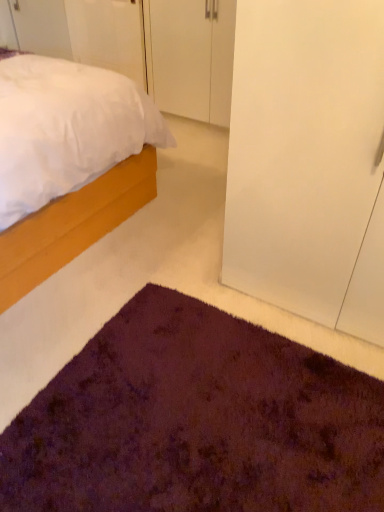
Question: Is transparent glass door at right in front of or behind purple shaggy rug at lower center in the image?

Choices:
 (A) behind
 (B) front

Answer: (A)

Question: Is point (268, 110) closer or farther from the camera than point (82, 393)?

Choices:
 (A) closer
 (B) farther

Answer: (A)

Question: Which of these objects is positioned farthest from the white matte cabinet at upper center, marked as the 2th door in a left-to-right arrangement?

Choices:
 (A) white matte door at upper left, which is the 2th door in right-to-left order
 (B) purple shaggy rug at lower center
 (C) transparent glass door at right
 (D) matte wood bed at left

Answer: (B)

Question: Estimate the real-world distances between objects in this image. Which object is closer to the white matte door at upper left, which is the 2th door in right-to-left order?

Choices:
 (A) white matte cabinet at upper center, marked as the 2th door in a left-to-right arrangement
 (B) transparent glass door at right
 (C) purple shaggy rug at lower center
 (D) matte wood bed at left

Answer: (A)